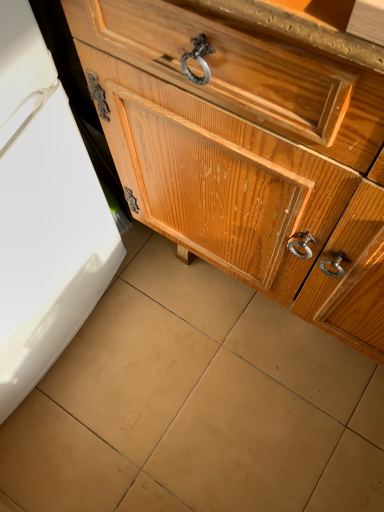
The width and height of the screenshot is (384, 512). What do you see at coordinates (245, 155) in the screenshot?
I see `glossy wood chest of drawers at center` at bounding box center [245, 155].

You are a GUI agent. You are given a task and a screenshot of the screen. Output one action in this format:
    pyautogui.click(x=<x>, y=<y>)
    Task: Click on the glossy wood chest of drawers at center
    The image size is (384, 512).
    Given the screenshot: What is the action you would take?
    pyautogui.click(x=245, y=155)

I want to click on brown matte tile at center, so click(196, 404).

What do you see at coordinates (196, 404) in the screenshot?
I see `brown matte tile at center` at bounding box center [196, 404].

Locate an element on the screen. This screenshot has height=512, width=384. glossy wood chest of drawers at center is located at coordinates (245, 155).

Considering the positions of objects brown matte tile at center and glossy wood chest of drawers at center in the image provided, who is more to the right, brown matte tile at center or glossy wood chest of drawers at center?

Positioned to the right is glossy wood chest of drawers at center.

Which object is more forward, brown matte tile at center or glossy wood chest of drawers at center?

glossy wood chest of drawers at center.

Does point (236, 376) appear closer or farther from the camera than point (139, 111)?

Point (236, 376).

From the image's perspective, is brown matte tile at center located above glossy wood chest of drawers at center?

No.

From a real-world perspective, is brown matte tile at center located higher than glossy wood chest of drawers at center?

Actually, brown matte tile at center is physically below glossy wood chest of drawers at center in the real world.

Considering the sizes of objects brown matte tile at center and glossy wood chest of drawers at center in the image provided, who is wider, brown matte tile at center or glossy wood chest of drawers at center?

With larger width is brown matte tile at center.

Is brown matte tile at center shorter than glossy wood chest of drawers at center?

Yes, brown matte tile at center is shorter than glossy wood chest of drawers at center.

Which of these two, brown matte tile at center or glossy wood chest of drawers at center, is bigger?

With larger size is glossy wood chest of drawers at center.

Is brown matte tile at center outside of glossy wood chest of drawers at center?

Yes, brown matte tile at center is outside of glossy wood chest of drawers at center.

Is brown matte tile at center touching glossy wood chest of drawers at center?

There is a gap between brown matte tile at center and glossy wood chest of drawers at center.

Is brown matte tile at center positioned with its back to glossy wood chest of drawers at center?

No, brown matte tile at center is not facing away from glossy wood chest of drawers at center.

What's the angular difference between brown matte tile at center and glossy wood chest of drawers at center's facing directions?

The angular difference between brown matte tile at center and glossy wood chest of drawers at center is 0.432 degrees.

How far apart are brown matte tile at center and glossy wood chest of drawers at center?

brown matte tile at center and glossy wood chest of drawers at center are 17.45 inches apart.

Locate an element on the screen. This screenshot has height=512, width=384. the chest of drawers positioned vertically above the brown matte tile at center (from a real-world perspective) is located at coordinates (245, 155).

Which is more to the left, glossy wood chest of drawers at center or brown matte tile at center?

Positioned to the left is brown matte tile at center.

Considering the positions of objects glossy wood chest of drawers at center and brown matte tile at center in the image provided, who is behind, glossy wood chest of drawers at center or brown matte tile at center?

brown matte tile at center.

Between point (158, 163) and point (340, 357), which one is positioned behind?

The point (340, 357) is more distant.

From the image's perspective, is glossy wood chest of drawers at center located above or below brown matte tile at center?

glossy wood chest of drawers at center is situated higher than brown matte tile at center in the image.

From a real-world perspective, which object rests below the other?

In real-world perspective, brown matte tile at center is lower.

Which of these two, glossy wood chest of drawers at center or brown matte tile at center, is thinner?

glossy wood chest of drawers at center.

Does glossy wood chest of drawers at center have a greater height compared to brown matte tile at center?

Correct, glossy wood chest of drawers at center is much taller as brown matte tile at center.

Which of these two, glossy wood chest of drawers at center or brown matte tile at center, is smaller?

brown matte tile at center is smaller.

Could brown matte tile at center be considered to be inside glossy wood chest of drawers at center?

No, brown matte tile at center is not a part of glossy wood chest of drawers at center.

Is the surface of glossy wood chest of drawers at center in direct contact with brown matte tile at center?

No, glossy wood chest of drawers at center is not in contact with brown matte tile at center.

Is glossy wood chest of drawers at center oriented towards brown matte tile at center?

Yes, glossy wood chest of drawers at center faces towards brown matte tile at center.

Find the location of a particular element. Image resolution: width=384 pixels, height=512 pixels. tile directly beneath the glossy wood chest of drawers at center (from a real-world perspective) is located at coordinates (196, 404).

Find the location of a particular element. tile on the left of glossy wood chest of drawers at center is located at coordinates (196, 404).

Where is `chest of drawers located on the right of brown matte tile at center`? chest of drawers located on the right of brown matte tile at center is located at coordinates (245, 155).